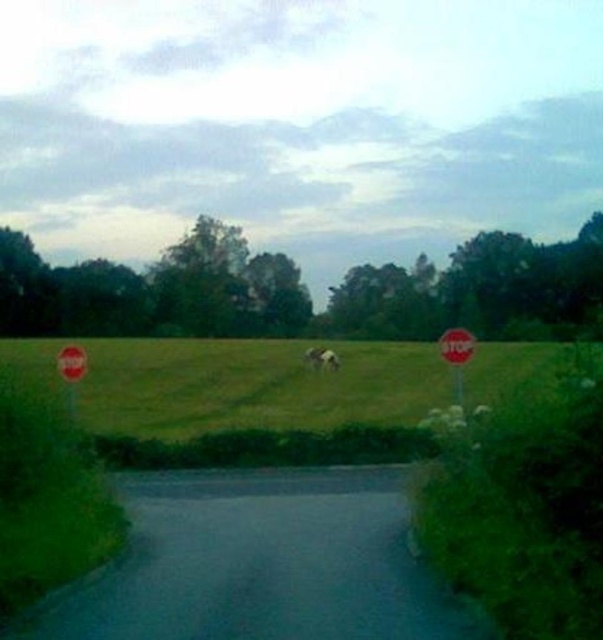
Looking at this image, can you confirm if red plastic stop sign at left is thinner than white fluffy cloud at center?

Indeed, red plastic stop sign at left has a lesser width compared to white fluffy cloud at center.

From the picture: Does red plastic stop sign at left have a lesser height compared to white fluffy cloud at center?

Yes.

Describe the element at coordinates (71, 362) in the screenshot. The width and height of the screenshot is (603, 640). I see `red plastic stop sign at left` at that location.

You are a GUI agent. You are given a task and a screenshot of the screen. Output one action in this format:
    pyautogui.click(x=<x>, y=<y>)
    Task: Click on the red plastic stop sign at left
    
    Given the screenshot: What is the action you would take?
    pyautogui.click(x=71, y=362)

How distant is green grass at center from red plastic stop sign at left?

green grass at center and red plastic stop sign at left are 21.17 meters apart from each other.

From the picture: Is green grass at center bigger than red plastic stop sign at left?

Correct, green grass at center is larger in size than red plastic stop sign at left.

Does point (379, 342) come closer to viewer compared to point (57, 358)?

No, it is behind (57, 358).

Where is `green grass at center`? green grass at center is located at coordinates (254, 385).

Between point (139, 388) and point (456, 349), which one is positioned behind?

The point (139, 388) is behind.

This screenshot has width=603, height=640. Describe the element at coordinates (254, 385) in the screenshot. I see `green grass at center` at that location.

This screenshot has width=603, height=640. Identify the location of green grass at center. (254, 385).